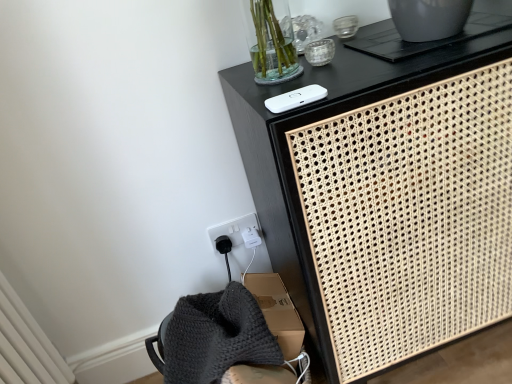
Question: In the image, is white woven cabinet at upper right on the left side or the right side of white matte ipod at upper center?

Choices:
 (A) left
 (B) right

Answer: (B)

Question: Is white woven cabinet at upper right in front of or behind white matte ipod at upper center in the image?

Choices:
 (A) behind
 (B) front

Answer: (B)

Question: Is point (313, 312) positioned closer to the camera than point (300, 104)?

Choices:
 (A) closer
 (B) farther

Answer: (B)

Question: From a real-world perspective, is white matte ipod at upper center physically located above or below white woven cabinet at upper right?

Choices:
 (A) above
 (B) below

Answer: (A)

Question: Is point (283, 96) positioned closer to the camera than point (225, 94)?

Choices:
 (A) closer
 (B) farther

Answer: (A)

Question: Is white matte ipod at upper center wider or thinner than white woven cabinet at upper right?

Choices:
 (A) wide
 (B) thin

Answer: (B)

Question: Is white matte ipod at upper center to the left or to the right of white woven cabinet at upper right in the image?

Choices:
 (A) left
 (B) right

Answer: (A)